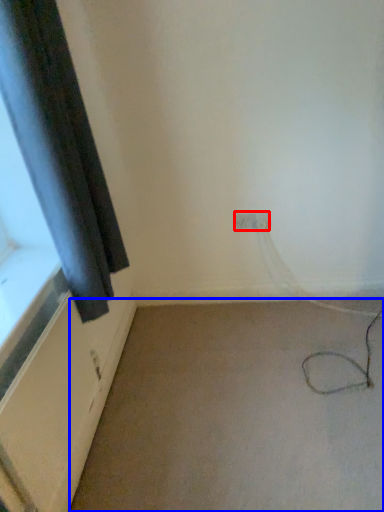
Question: Which object appears farthest to the camera in this image, electric outlet (highlighted by a red box) or plain (highlighted by a blue box)?

Choices:
 (A) electric outlet
 (B) plain

Answer: (A)